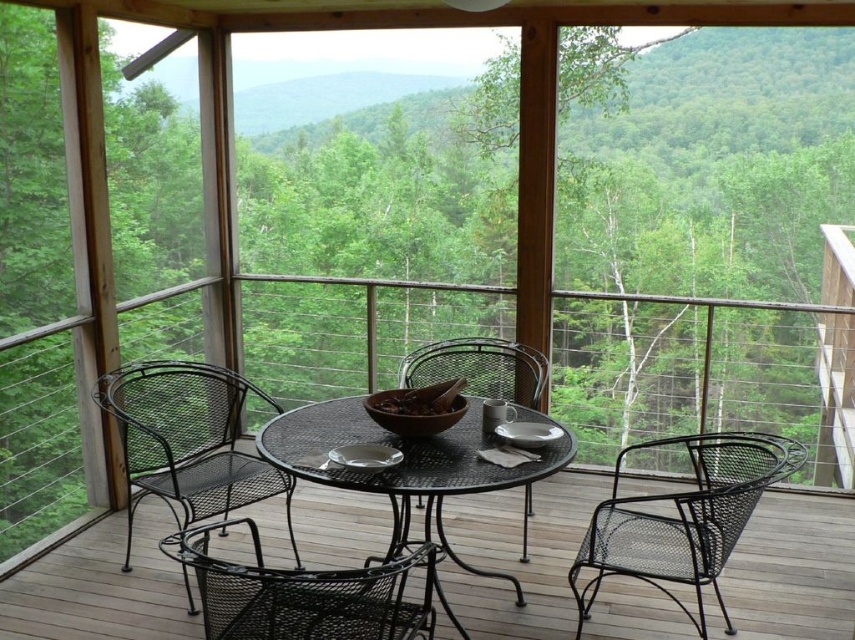
You are sitting on the black mesh chair at lower center and want to reach the mug on the black metal table at center. Is the table higher or lower than your seat?

The black metal table at center is above the black mesh chair at lower center, meaning the table is higher than your seat.

You are sitting on the black mesh chair at lower right and want to reach the mug on the black metal table at center. Which direction should you move to get it?

Since the black mesh chair at lower right is located below the black metal table at center, you should move upward to reach the mug on the black metal table at center.